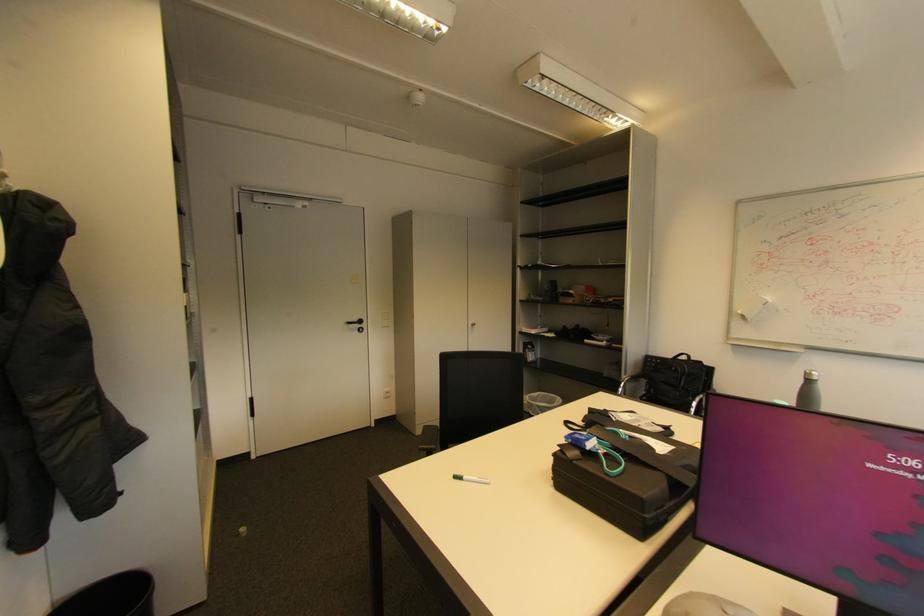
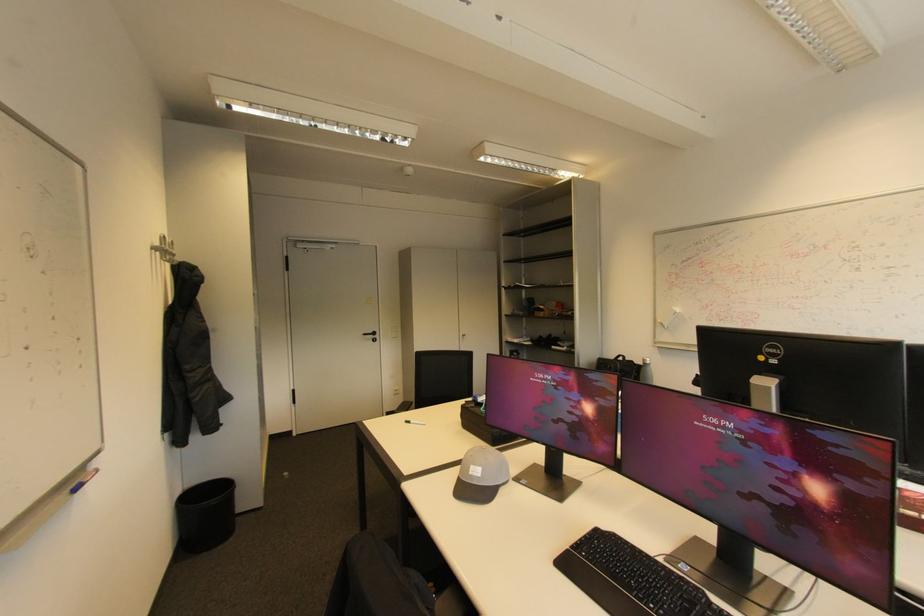
Question: How did the camera likely rotate?

Choices:
 (A) Left
 (B) Right
 (C) Up
 (D) Down

Answer: (A)